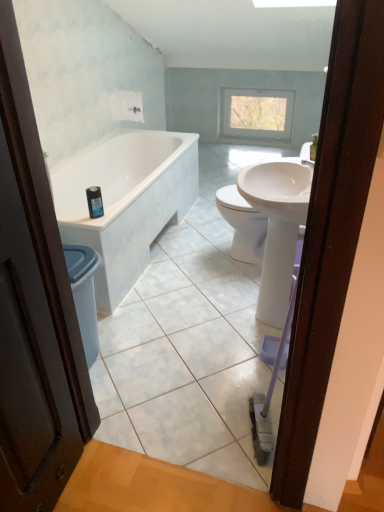
Where is `free space to the left of white glossy sink at center`? The width and height of the screenshot is (384, 512). free space to the left of white glossy sink at center is located at coordinates (193, 321).